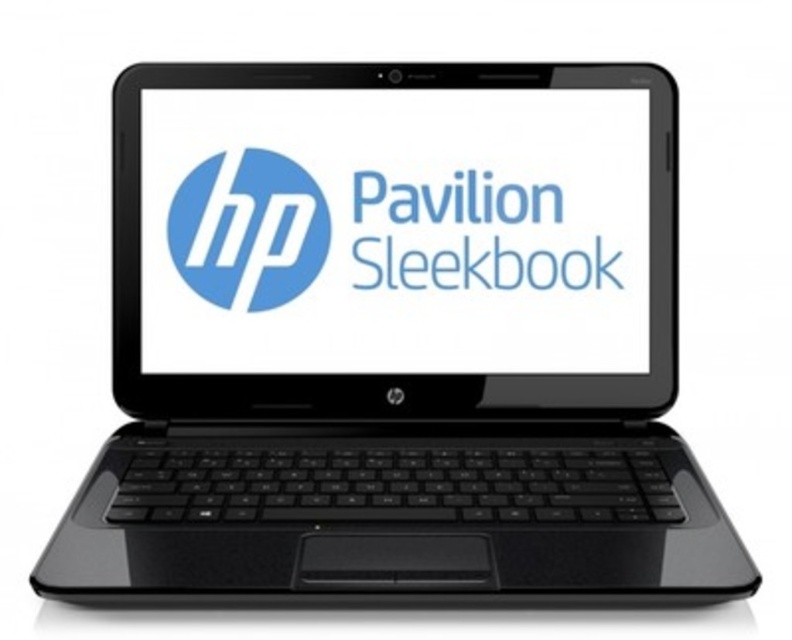
Question: Does matte black screen at center have a smaller size compared to blue glossy pavilion sleekbook at center?

Choices:
 (A) yes
 (B) no

Answer: (B)

Question: Which point is closer to the camera?

Choices:
 (A) matte blue circle at center
 (B) matte black screen at center
 (C) blue glossy pavilion sleekbook at center

Answer: (B)

Question: Which object is the farthest from the matte blue circle at center?

Choices:
 (A) blue glossy pavilion sleekbook at center
 (B) matte black screen at center

Answer: (A)

Question: Based on their relative distances, which object is nearer to the blue glossy pavilion sleekbook at center?

Choices:
 (A) matte black screen at center
 (B) matte blue circle at center

Answer: (A)

Question: Does matte black screen at center lie behind blue glossy pavilion sleekbook at center?

Choices:
 (A) yes
 (B) no

Answer: (B)

Question: Can you confirm if matte black screen at center is bigger than blue glossy pavilion sleekbook at center?

Choices:
 (A) no
 (B) yes

Answer: (B)